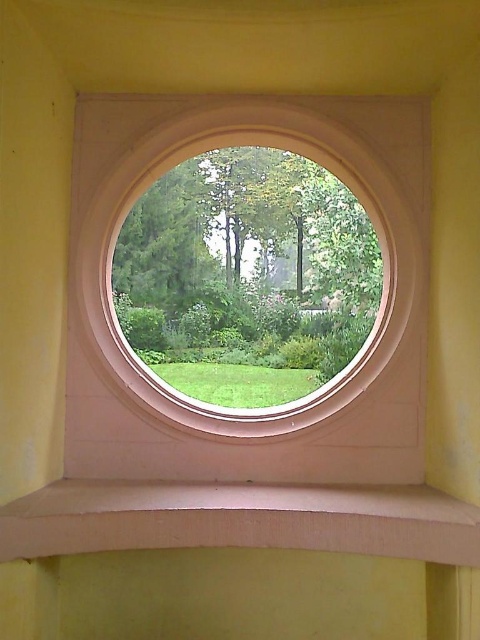
Can you confirm if white smooth window frame at center is positioned below smooth beige ledge at lower center?

No.

Is white smooth window frame at center behind smooth beige ledge at lower center?

Yes, white smooth window frame at center is further from the viewer.

Where is `white smooth window frame at center`? white smooth window frame at center is located at coordinates (251, 412).

The height and width of the screenshot is (640, 480). I want to click on white smooth window frame at center, so click(251, 412).